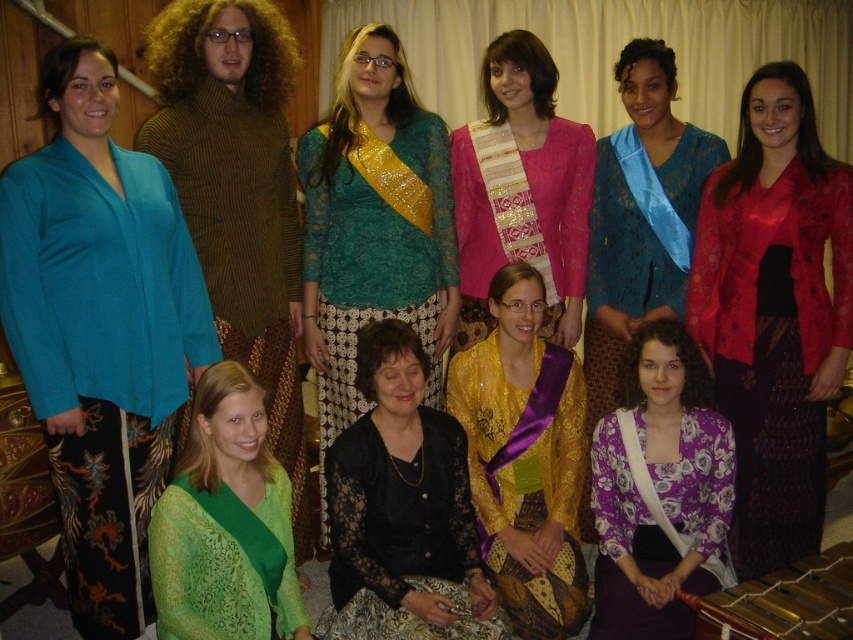
Based on the photo, who is more distant from viewer, (x=733, y=508) or (x=360, y=429)?

Point (x=733, y=508)

Can you confirm if satin red blouse at upper right is positioned below black lace dress at center?

No.

Between point (840, 284) and point (479, 586), which one is positioned in front?

Positioned in front is point (479, 586).

Where is `satin red blouse at upper right`? This screenshot has width=853, height=640. satin red blouse at upper right is located at coordinates (775, 314).

Is gold sequined blouse at center in front of matte blue dress at center?

Yes.

The image size is (853, 640). What are the coordinates of `gold sequined blouse at center` in the screenshot? It's located at (525, 458).

Is point (526, 307) behind point (659, 196)?

No, it is not.

You are a GUI agent. You are given a task and a screenshot of the screen. Output one action in this format:
    pyautogui.click(x=<x>, y=<y>)
    Task: Click on the gold sequined blouse at center
    
    Given the screenshot: What is the action you would take?
    pyautogui.click(x=525, y=458)

Does satin red blouse at upper right appear under lace teal blouse at upper center?

Indeed, satin red blouse at upper right is positioned under lace teal blouse at upper center.

Does satin red blouse at upper right have a lesser height compared to lace teal blouse at upper center?

Indeed, satin red blouse at upper right has a lesser height compared to lace teal blouse at upper center.

Is point (816, 460) positioned before point (343, 88)?

Yes, point (816, 460) is closer to viewer.

You are a GUI agent. You are given a task and a screenshot of the screen. Output one action in this format:
    pyautogui.click(x=<x>, y=<y>)
    Task: Click on the satin red blouse at upper right
    
    Given the screenshot: What is the action you would take?
    pyautogui.click(x=775, y=314)